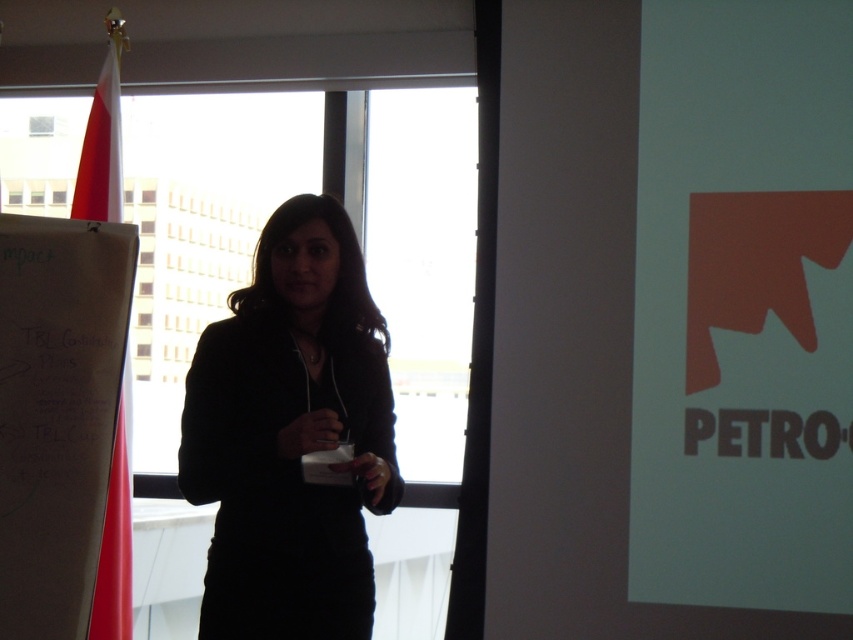
Can you confirm if black matte dress at center is taller than red fabric flag at left?

Correct, black matte dress at center is much taller as red fabric flag at left.

Does point (218, 634) come in front of point (113, 492)?

Yes, it is in front of point (113, 492).

Who is more forward, (210, 442) or (107, 148)?

Positioned in front is point (210, 442).

Where is `black matte dress at center`? Image resolution: width=853 pixels, height=640 pixels. black matte dress at center is located at coordinates (291, 435).